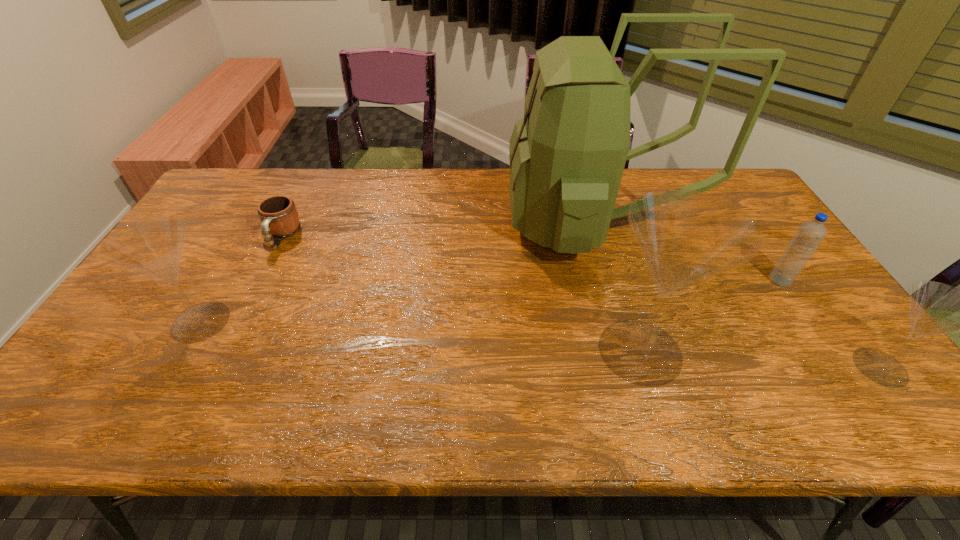
Identify the location of vacant spot for a new flute_glass to ensure equal spacing. The height and width of the screenshot is (540, 960). point(414,336).